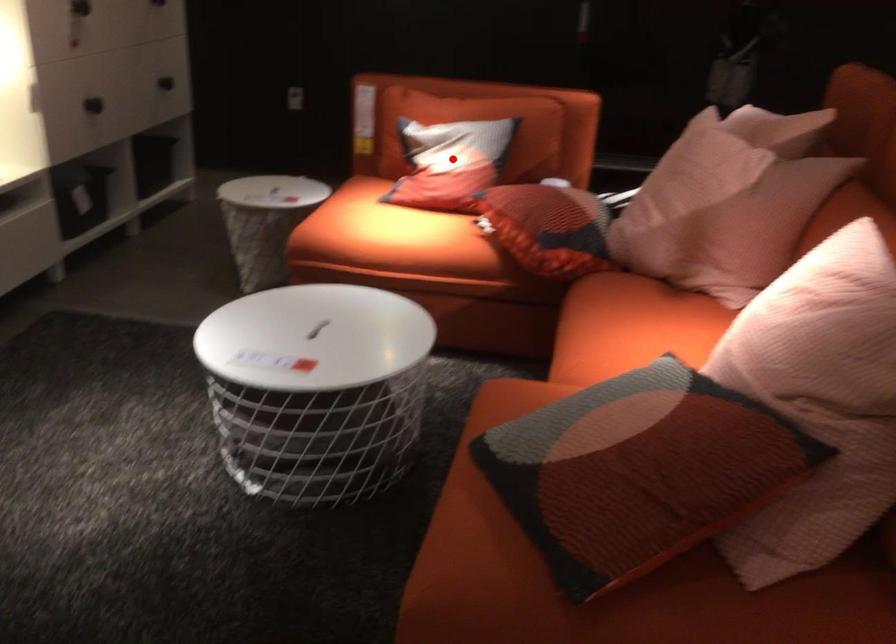
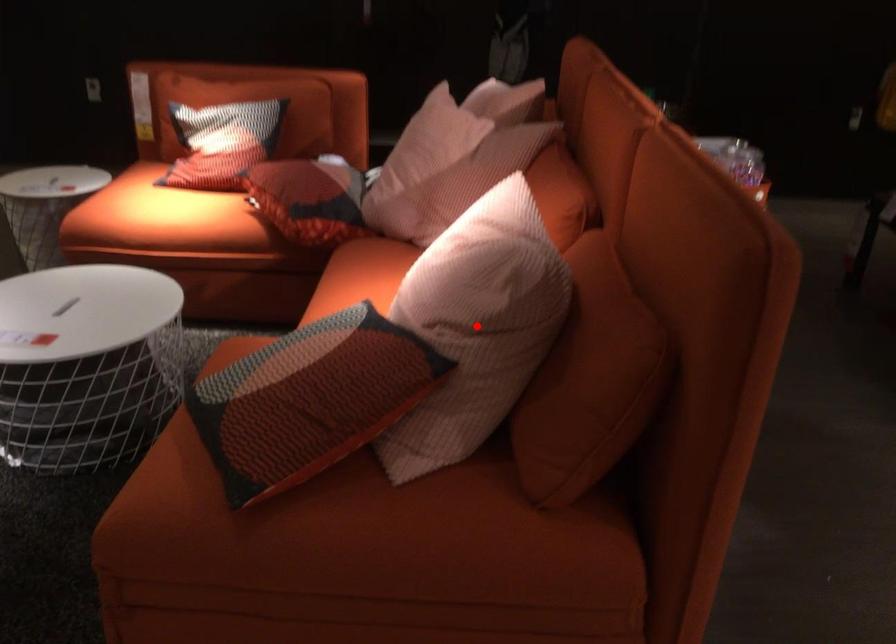
I am providing you with two images of the same scene from different viewpoints. A red point is marked on the first image and another point is marked on the second image. Is the red point in image1 aligned with the point shown in image2?

No